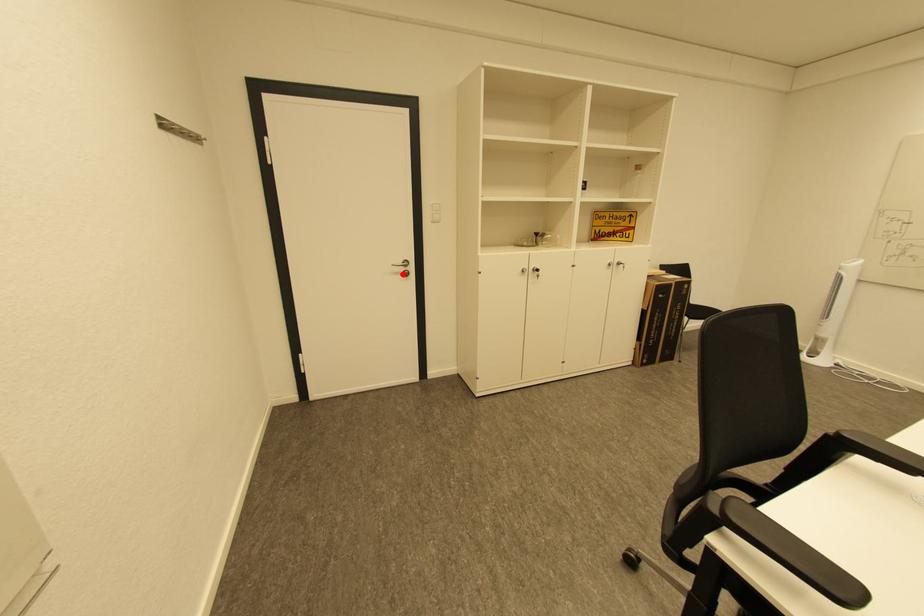
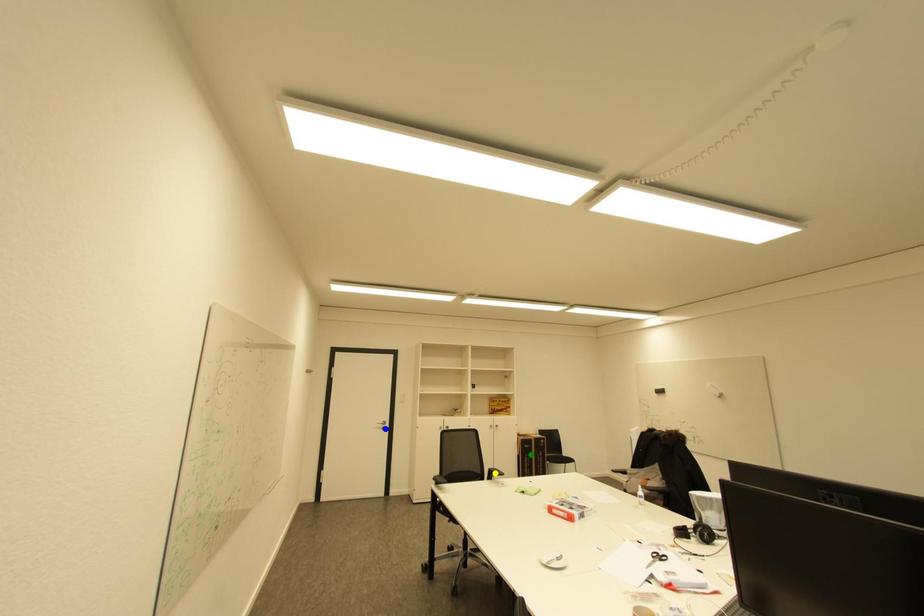
Question: I am providing you with two images of the same scene from different viewpoints. A red point is marked on the first image. You are given multiple points on the second image. Which point in image 2 represents the same 3d spot as the red point in image 1?

Choices:
 (A) yellow point
 (B) green point
 (C) blue point

Answer: (C)